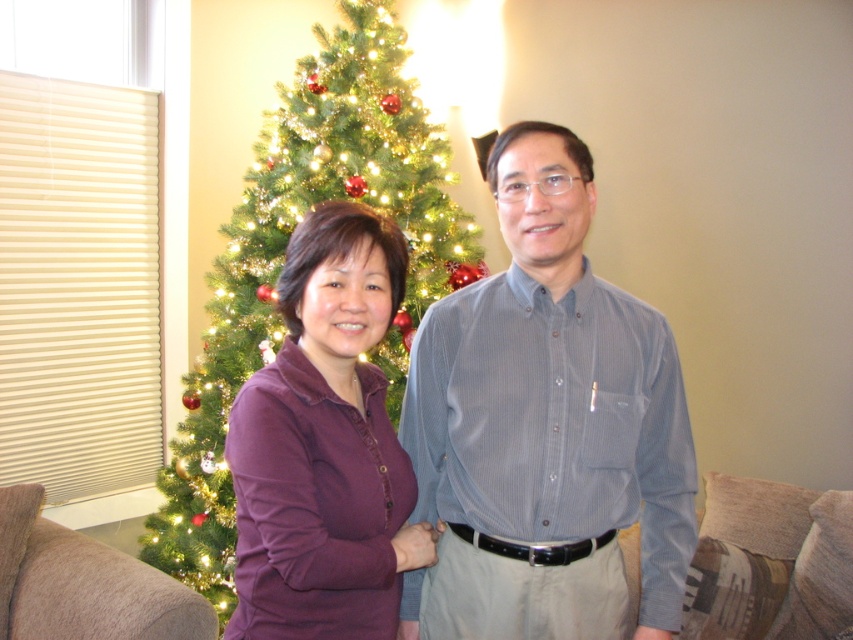
Question: Which of the following is the closest to the observer?

Choices:
 (A) green textured christmas tree at center
 (B) purple cotton shirt at center

Answer: (B)

Question: Does green textured christmas tree at center lie in front of purple cotton shirt at center?

Choices:
 (A) no
 (B) yes

Answer: (A)

Question: Among these points, which one is nearest to the camera?

Choices:
 (A) (543, 192)
 (B) (300, 180)
 (C) (317, 557)

Answer: (C)

Question: Which object appears farthest from the camera in this image?

Choices:
 (A) green textured christmas tree at center
 (B) purple cotton shirt at center
 (C) blue striped shirt at center

Answer: (A)

Question: Is blue striped shirt at center below purple cotton shirt at center?

Choices:
 (A) yes
 (B) no

Answer: (B)

Question: In this image, where is green textured christmas tree at center located relative to purple cotton shirt at center?

Choices:
 (A) above
 (B) below

Answer: (A)